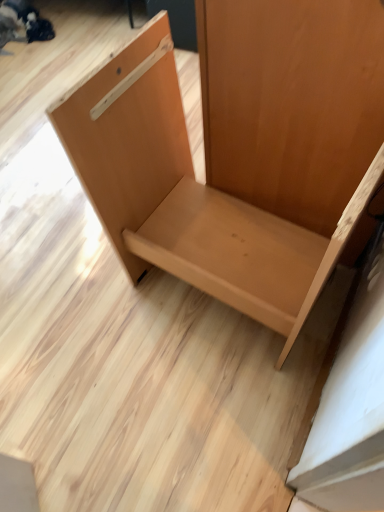
What is the approximate width of light brown wood chair at center?

light brown wood chair at center is 17.21 inches in width.

What are the coordinates of `light brown wood chair at center` in the screenshot? It's located at (239, 151).

The width and height of the screenshot is (384, 512). What do you see at coordinates (239, 151) in the screenshot? I see `light brown wood chair at center` at bounding box center [239, 151].

Where is `light brown wood chair at center`? light brown wood chair at center is located at coordinates (239, 151).